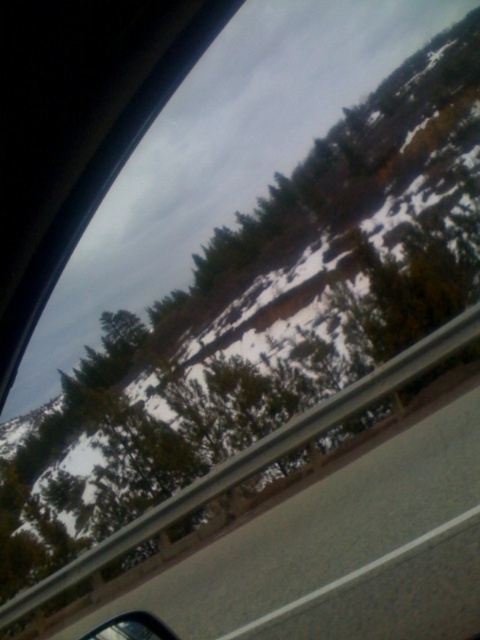
Is gray concrete highway at lower center above glossy metallic car mirror at lower left?

No.

Measure the distance between gray concrete highway at lower center and camera.

The distance of gray concrete highway at lower center from camera is 8.77 meters.

Where is `gray concrete highway at lower center`? The height and width of the screenshot is (640, 480). gray concrete highway at lower center is located at coordinates (277, 492).